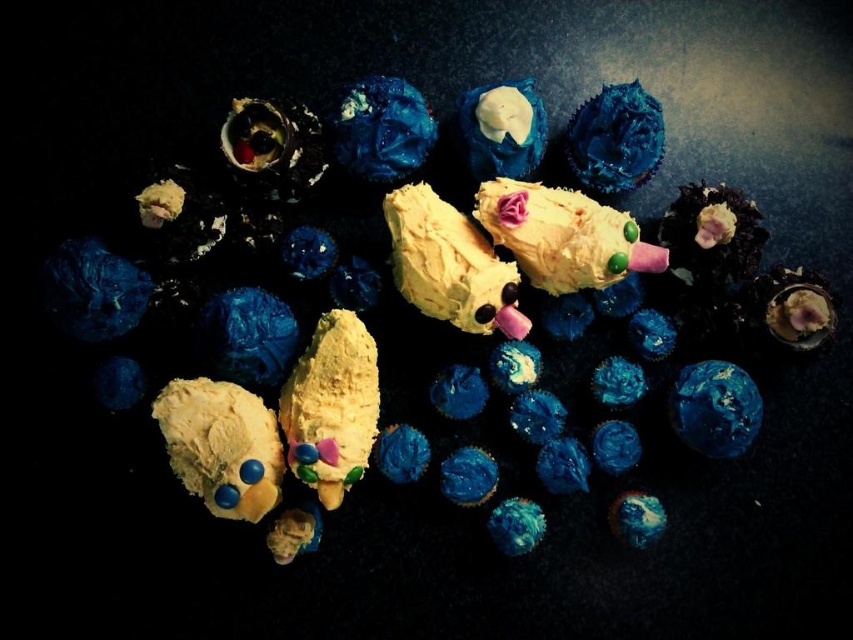
Based on the photo, you are a child trying to grab the closest toy or treat from your current position. You see a matte yellow plush toy at center and a matte blue cupcake at upper center. Which one can you reach first without moving your hand?

The matte yellow plush toy at center is closer to the viewer than the matte blue cupcake at upper center, so you can reach the matte yellow plush toy at center first.

You are a baker who needs to place a 12 inch long ribbon between the yellow matte ice cream cone at center and the matte blue cupcake at upper center. Will the ribbon be long enough to stretch between them?

The distance between the yellow matte ice cream cone at center and the matte blue cupcake at upper center is 10.89 inches. Since the ribbon is 12 inches long, it will be long enough to stretch between them with some extra length remaining.

You are a customer at a bakery and see the yellow matte ice cream cone at center and the matte blue cupcake at upper center. Which one is more to the left?

The yellow matte ice cream cone at center is more to the left because it is positioned on the left side of the matte blue cupcake at upper center.